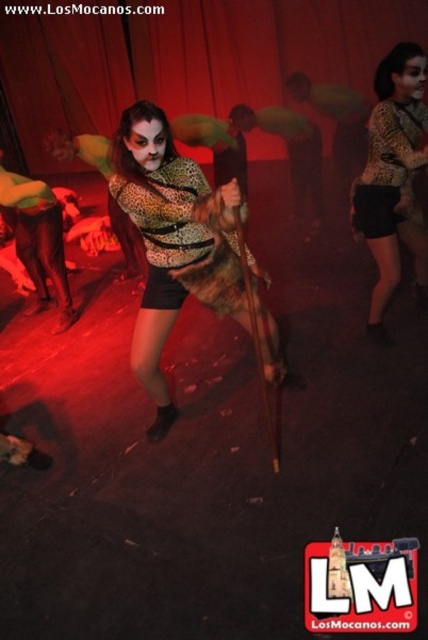
Does point (148, 371) lie in front of point (418, 64)?

Yes, it is in front of point (418, 64).

In the scene shown: Who is more forward, (139,324) or (385,77)?

Point (139,324) is in front.

Identify the location of leopard print top at center. (172, 241).